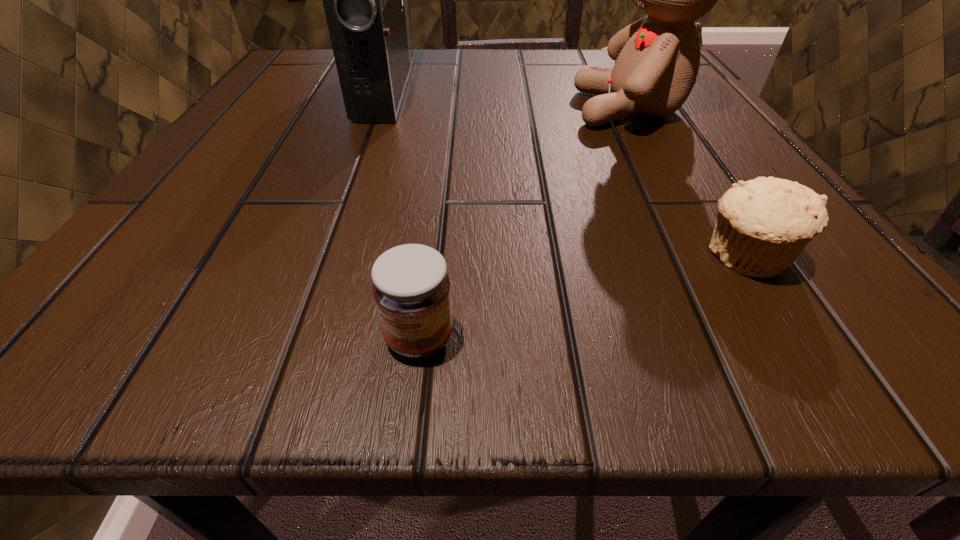
At what (x,y) coordinates should I click in order to perform the action: click on free area in between the nearest object and the radio receiver. Please return your answer as a coordinate pair (x, y). The width and height of the screenshot is (960, 540). Looking at the image, I should click on (403, 213).

You are a GUI agent. You are given a task and a screenshot of the screen. Output one action in this format:
    pyautogui.click(x=<x>, y=<y>)
    Task: Click on the free space between the third farthest object and the second object from left to right
    
    Given the screenshot: What is the action you would take?
    pyautogui.click(x=582, y=297)

Where is `unoccupied position between the leftmost object and the rag_doll`? This screenshot has height=540, width=960. unoccupied position between the leftmost object and the rag_doll is located at coordinates (509, 98).

The height and width of the screenshot is (540, 960). What are the coordinates of `object identified as the third closest to the muffin` in the screenshot? It's located at (366, 0).

The image size is (960, 540). Find the location of `object that ranks as the second closest to the nearest object`. object that ranks as the second closest to the nearest object is located at coordinates (366, 0).

The height and width of the screenshot is (540, 960). I want to click on free spot that satisfies the following two spatial constraints: 1. on the back side of the muffin; 2. on the front-facing side of the rag_doll, so click(x=652, y=109).

Identify the location of free location that satisfies the following two spatial constraints: 1. on the back side of the muffin; 2. on the front-facing side of the leftmost object. (638, 88).

Find the location of a particular element. The height and width of the screenshot is (540, 960). vacant space that satisfies the following two spatial constraints: 1. on the back side of the muffin; 2. on the right side of the jam is located at coordinates (429, 256).

Find the location of a particular element. The image size is (960, 540). vacant space that satisfies the following two spatial constraints: 1. on the front-facing side of the rag_doll; 2. on the left side of the muffin is located at coordinates (714, 256).

Identify the location of vacant region that satisfies the following two spatial constraints: 1. on the front-facing side of the rag_doll; 2. on the left side of the second nearest object. The height and width of the screenshot is (540, 960). 714,256.